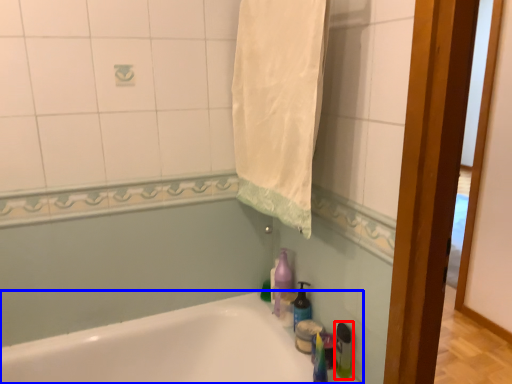
Question: Which object appears farthest to the camera in this image, bottle (highlighted by a red box) or bathtub (highlighted by a blue box)?

Choices:
 (A) bottle
 (B) bathtub

Answer: (A)